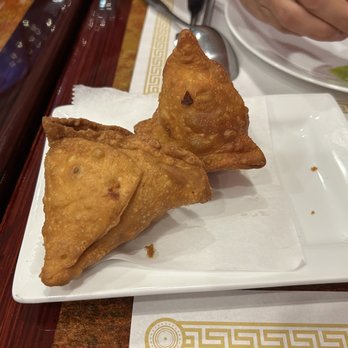
This screenshot has height=348, width=348. I want to click on place to hold the spoon, so click(182, 20).